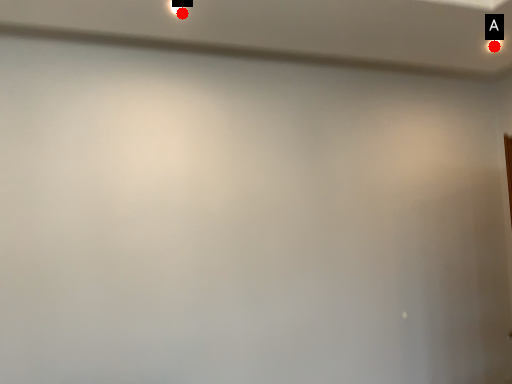
Question: Two points are circled on the image, labeled by A and B beside each circle. Which point is farther to the camera?

Choices:
 (A) A is further
 (B) B is further

Answer: (A)